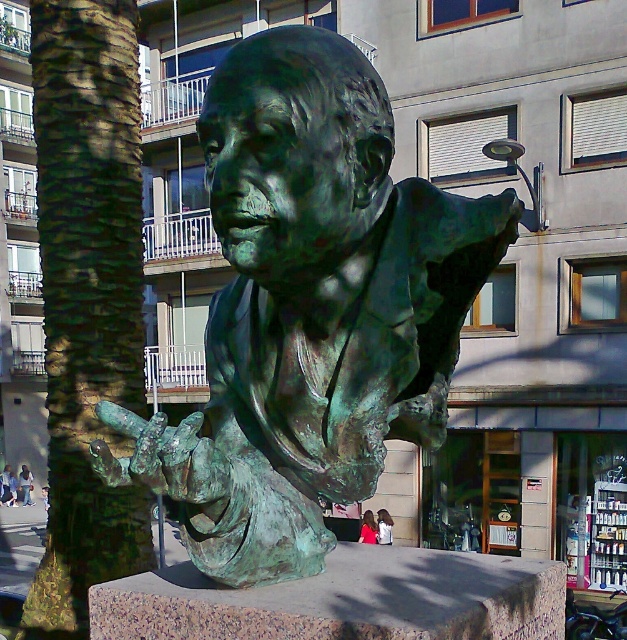
You are an artist standing in front of the sculpture and want to place a pink fabric at lower center. You notice a green textured bark at left. Which object is positioned to the left of the other?

The green textured bark at left is positioned to the left of the pink fabric at lower center.

You are an artist observing the bronze bust sculpture in the public space. You notice the red shirt at lower center and the pink fabric at lower center. Which object is positioned higher in the scene?

The red shirt at lower center is taller than the pink fabric at lower center, so the red shirt at lower center is positioned higher in the scene.

You are an artist examining the bronze bust sculpture in the public space. You notice a specific location on the sculpture where the green textured bark at left is present. What are the coordinates of this feature?

The green textured bark at left is located at coordinates point (87, 296).